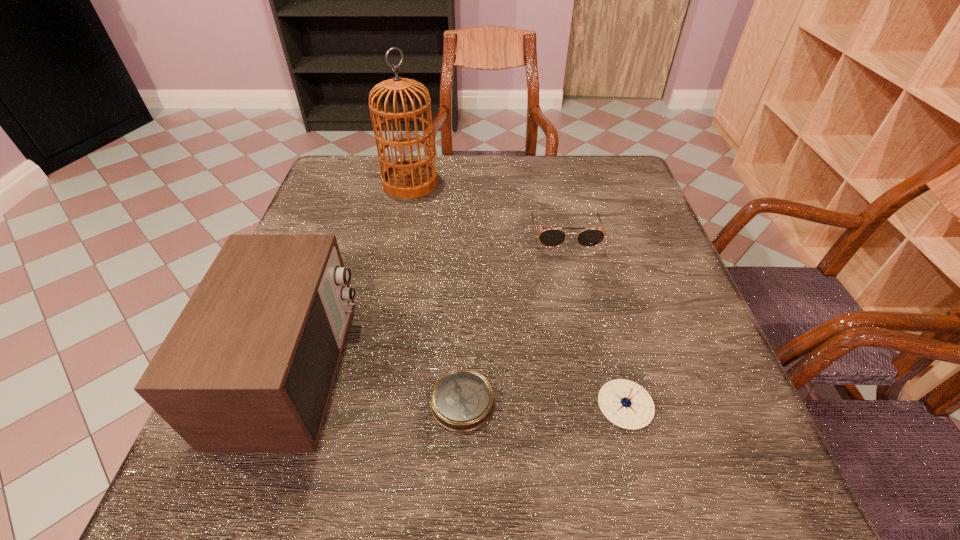
This screenshot has width=960, height=540. What are the coordinates of `the farthest object` in the screenshot? It's located at (410, 178).

At what (x,y) coordinates should I click in order to perform the action: click on birdcage. Please return your answer as a coordinate pair (x, y). Image resolution: width=960 pixels, height=540 pixels. Looking at the image, I should click on (410, 178).

The image size is (960, 540). Identify the location of the second tallest object. (249, 366).

At what (x,y) coordinates should I click in order to perform the action: click on sunglasses. Please return your answer as a coordinate pair (x, y). Image resolution: width=960 pixels, height=540 pixels. Looking at the image, I should click on (551, 237).

Where is `the fourth nearest object`? The height and width of the screenshot is (540, 960). the fourth nearest object is located at coordinates (551, 237).

Locate an element on the screen. The height and width of the screenshot is (540, 960). the taller compass is located at coordinates (626, 404).

The height and width of the screenshot is (540, 960). I want to click on the right compass, so click(626, 404).

Where is `the shorter compass`? This screenshot has height=540, width=960. the shorter compass is located at coordinates coord(462,400).

This screenshot has height=540, width=960. In order to click on the shortest object in this screenshot , I will do `click(462, 400)`.

The image size is (960, 540). In order to click on vacant space located 0.160m on the front of the tallest object in this screenshot , I will do `click(399, 237)`.